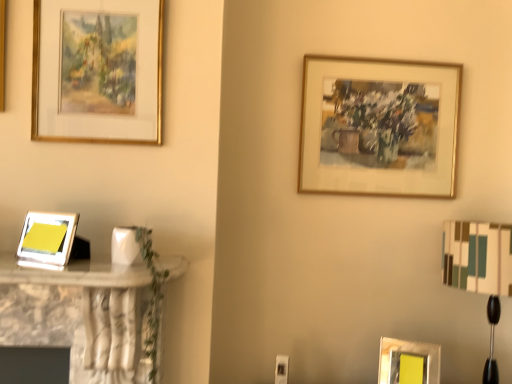
At what (x,y) coordinates should I click in order to perform the action: click on free space in front of matte silver picture frame at left, the first picture frame viewed from the left. Please return your answer as a coordinate pair (x, y). Image resolution: width=512 pixels, height=384 pixels. Looking at the image, I should click on (44, 270).